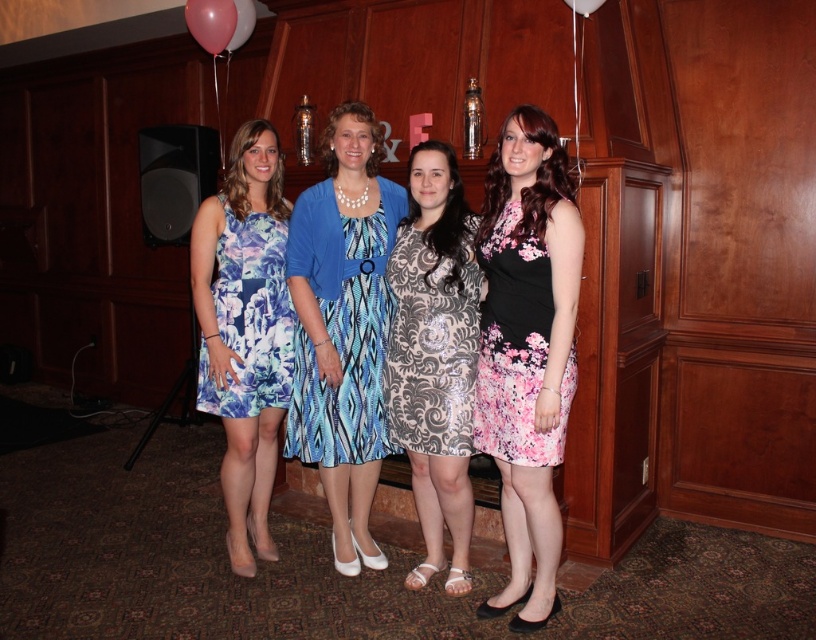
You are a photographer setting up for a group photo. You need to ensure that the printed fabric dress at center and the floral print fabric dress at left are at least 24 inches apart to avoid overlapping in the frame. Based on the scene description, can you confirm if they are sufficiently spaced apart?

The distance between the printed fabric dress at center and the floral print fabric dress at left is 25.08 inches, which is more than the required 24 inches. Therefore, they are sufficiently spaced apart to avoid overlapping in the frame.

You are a photographer standing at the camera position. You want to capture a closeup shot of the printed fabric dress at center. Considering the distance, can you get a clear closeup without moving closer?

The printed fabric dress at center is 8.22 feet away from the camera. A professional camera can capture clear closeup shots from this distance, so yes, you can get a clear closeup without moving closer.